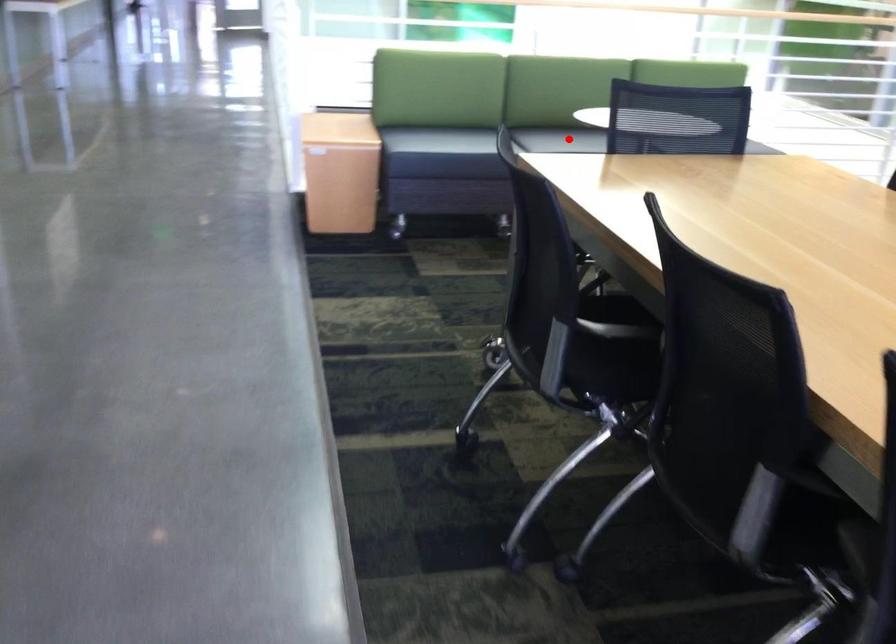
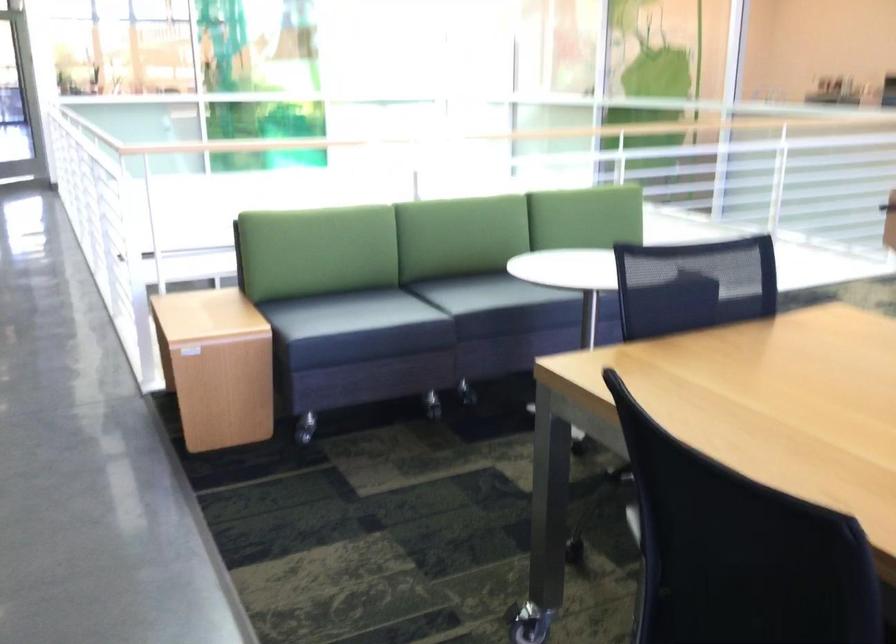
Question: I am providing you with two images of the same scene from different viewpoints. A red point is marked on the first image. Is the red point's position out of view in image 2?

Choices:
 (A) Yes
 (B) No

Answer: (B)